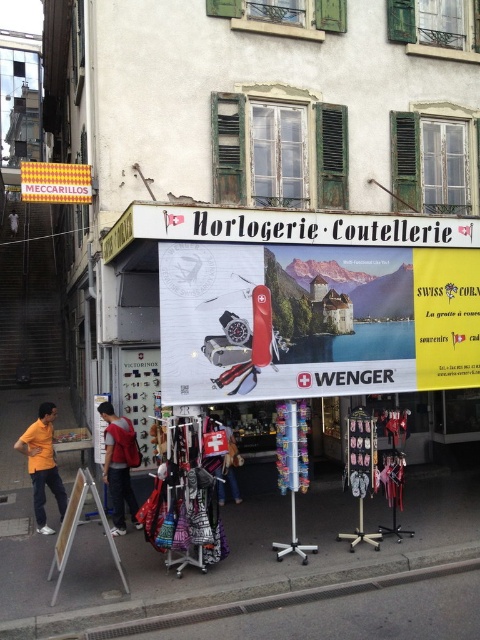
Question: Estimate the real-world distances between objects in this image. Which object is closer to the orange t-shirt at left?

Choices:
 (A) gray concrete curb at lower center
 (B) red backpack at center

Answer: (B)

Question: Is orange t-shirt at left smaller than yellow paper sign at upper center?

Choices:
 (A) no
 (B) yes

Answer: (B)

Question: Does orange t-shirt at left appear under yellow paper sign at upper center?

Choices:
 (A) yes
 (B) no

Answer: (A)

Question: Which point appears farthest from the camera in this image?

Choices:
 (A) (79, 186)
 (B) (236, 449)
 (C) (121, 500)

Answer: (A)

Question: Does orange t-shirt at left lie behind denim jacket at center?

Choices:
 (A) no
 (B) yes

Answer: (A)

Question: Which point is closer to the camera?

Choices:
 (A) (43, 637)
 (B) (110, 531)
 (C) (33, 163)
 (D) (223, 424)

Answer: (A)